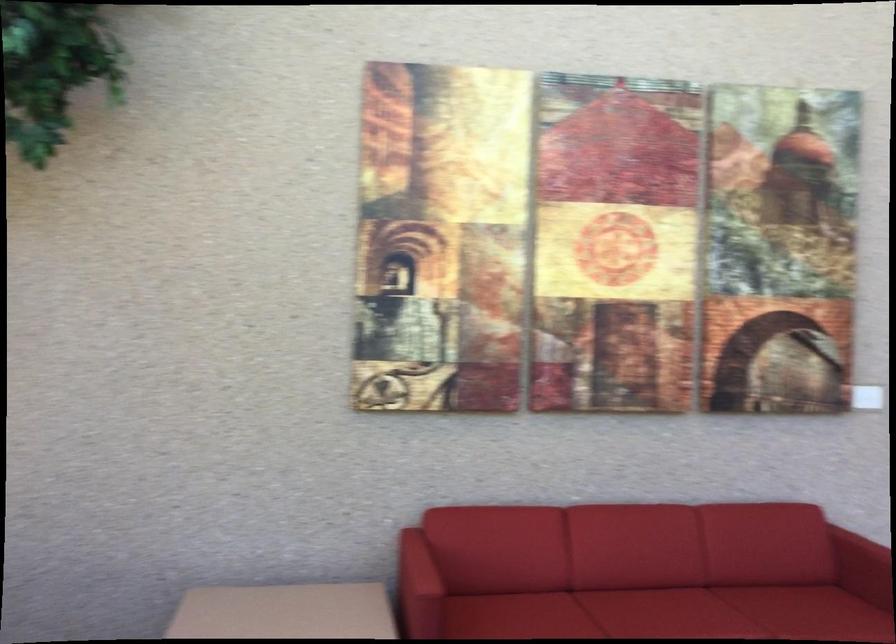
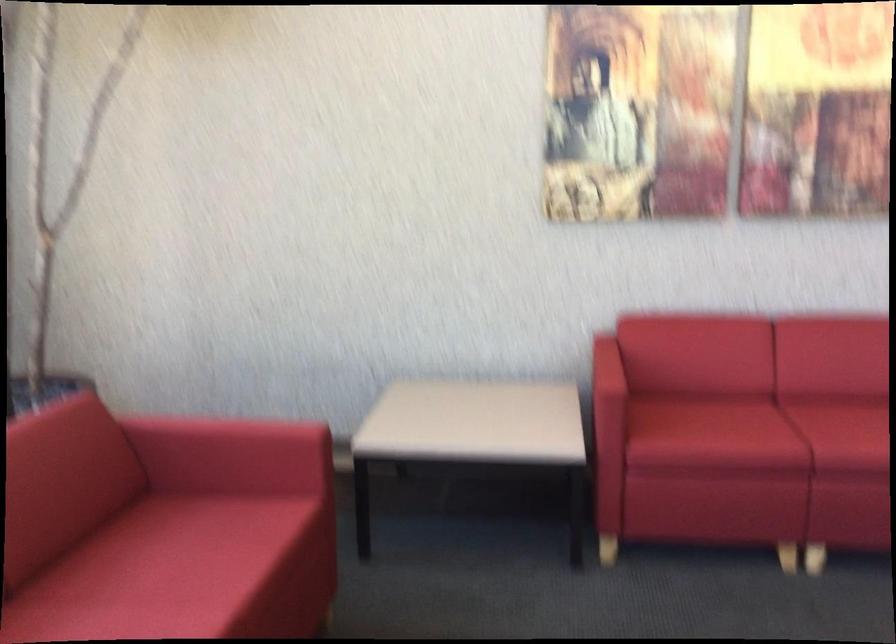
What movement of the cameraman would produce the second image?

The cameraman walked toward right, forward.